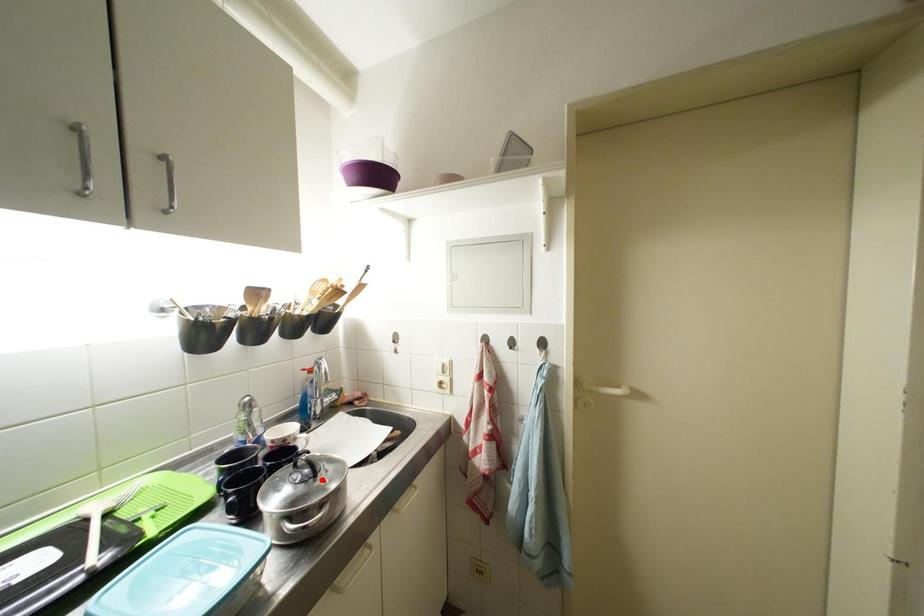
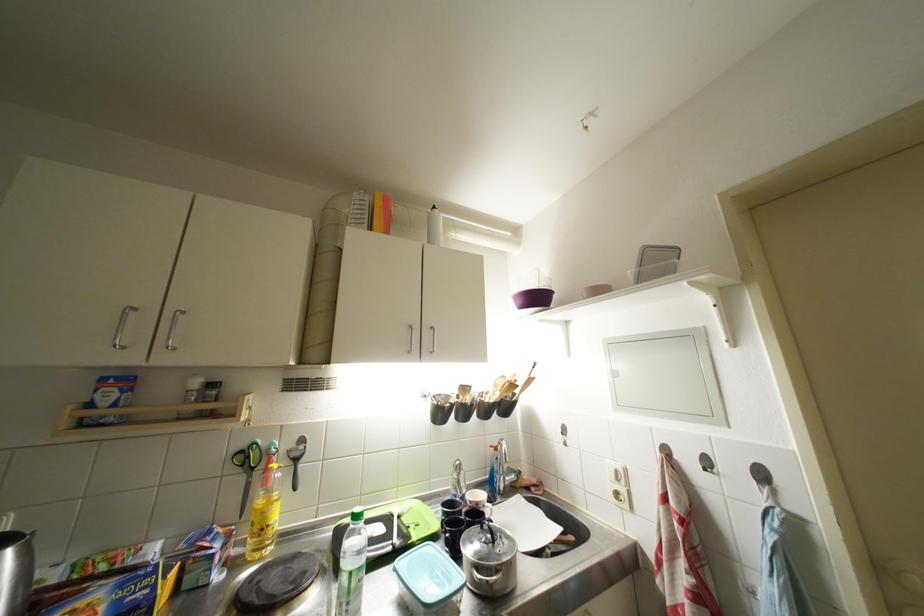
Find the pixel in the second image that matches the highlighted location in the first image.

(500, 546)